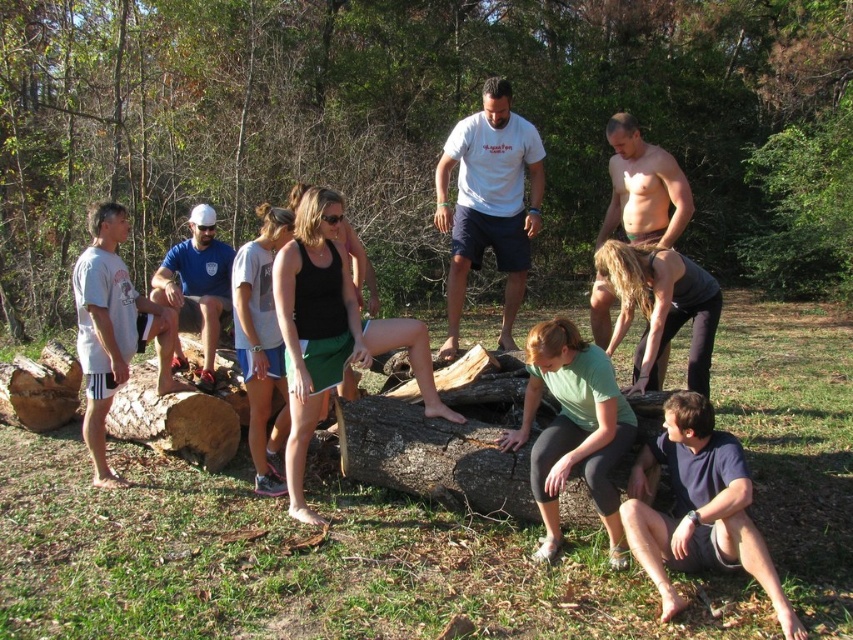
Question: Is green matte shirt at lower center above dark brown leggings at center?

Choices:
 (A) yes
 (B) no

Answer: (B)

Question: Which point is farther to the camera?

Choices:
 (A) (579, 440)
 (B) (490, 218)
 (C) (213, 250)

Answer: (C)

Question: Does brown rough tree trunk at center appear on the left side of white matte shorts at left?

Choices:
 (A) no
 (B) yes

Answer: (A)

Question: Estimate the real-world distances between objects in this image. Which object is farther from the white matte shorts at left?

Choices:
 (A) white t-shirt at center
 (B) dark blue fabric squat at lower right
 (C) dark brown leggings at center

Answer: (B)

Question: Is white t-shirt at center below white matte shorts at left?

Choices:
 (A) no
 (B) yes

Answer: (A)

Question: Which point is farther from the camera taking this photo?

Choices:
 (A) (107, 385)
 (B) (206, 248)

Answer: (B)